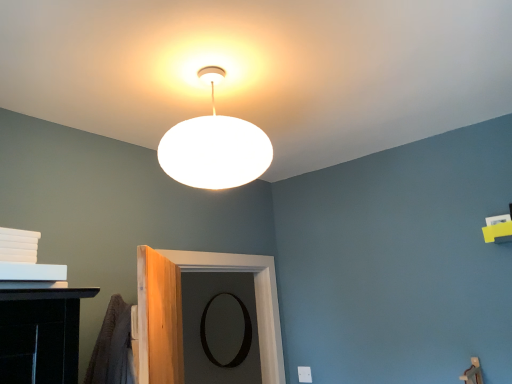
Question: From a real-world perspective, is black matte mirror at center under white matte lampshade at upper center?

Choices:
 (A) yes
 (B) no

Answer: (A)

Question: Is white matte lampshade at upper center at the back of black matte mirror at center?

Choices:
 (A) no
 (B) yes

Answer: (A)

Question: Is black matte mirror at center thinner than white matte lampshade at upper center?

Choices:
 (A) yes
 (B) no

Answer: (A)

Question: Does black matte mirror at center come in front of white matte lampshade at upper center?

Choices:
 (A) no
 (B) yes

Answer: (A)

Question: Is black matte mirror at center at the right side of white matte lampshade at upper center?

Choices:
 (A) yes
 (B) no

Answer: (B)

Question: Is white matte lampshade at upper center located within black matte mirror at center?

Choices:
 (A) yes
 (B) no

Answer: (B)

Question: Could you tell me if black matte mirror at center is turned towards black matte door at center?

Choices:
 (A) no
 (B) yes

Answer: (A)

Question: Considering the relative sizes of black matte mirror at center and black matte door at center in the image provided, is black matte mirror at center taller than black matte door at center?

Choices:
 (A) yes
 (B) no

Answer: (A)

Question: Does black matte mirror at center contain black matte door at center?

Choices:
 (A) yes
 (B) no

Answer: (B)

Question: Is black matte mirror at center behind black matte door at center?

Choices:
 (A) yes
 (B) no

Answer: (A)

Question: Is black matte mirror at center far from black matte door at center?

Choices:
 (A) yes
 (B) no

Answer: (A)

Question: Is black matte mirror at center to the left of black matte door at center from the viewer's perspective?

Choices:
 (A) yes
 (B) no

Answer: (A)

Question: From the image's perspective, is white matte lampshade at upper center located above black matte door at center?

Choices:
 (A) yes
 (B) no

Answer: (A)